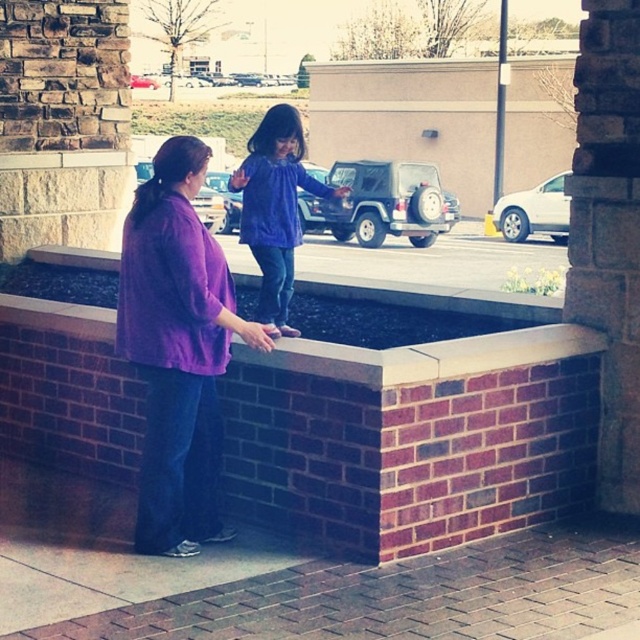
Who is higher up, brick ledge at center or purple matte dress at center?

purple matte dress at center is above.

Is point (88, 250) positioned behind point (291, 125)?

That is True.

Between point (320, 358) and point (276, 285), which one is positioned behind?

The point (276, 285) is more distant.

In order to click on brick ledge at center in this screenshot , I will do `click(428, 355)`.

Does brick pillar at center come behind purple matte dress at center?

No, it is in front of purple matte dress at center.

Can you confirm if brick pillar at center is smaller than purple matte dress at center?

Yes, brick pillar at center is smaller than purple matte dress at center.

Where is `brick pillar at center`? brick pillar at center is located at coordinates tap(609, 234).

Can you confirm if purple matte shirt at left is positioned above purple matte dress at center?

Incorrect, purple matte shirt at left is not positioned above purple matte dress at center.

Measure the distance between purple matte shirt at left and purple matte dress at center.

purple matte shirt at left and purple matte dress at center are 35.26 inches apart.

Measure the distance between purple matte shirt at left and camera.

Answer: The distance of purple matte shirt at left from camera is 13.20 feet.

At what (x,y) coordinates should I click in order to perform the action: click on purple matte shirt at left. Please return your answer as a coordinate pair (x, y). Looking at the image, I should click on (177, 349).